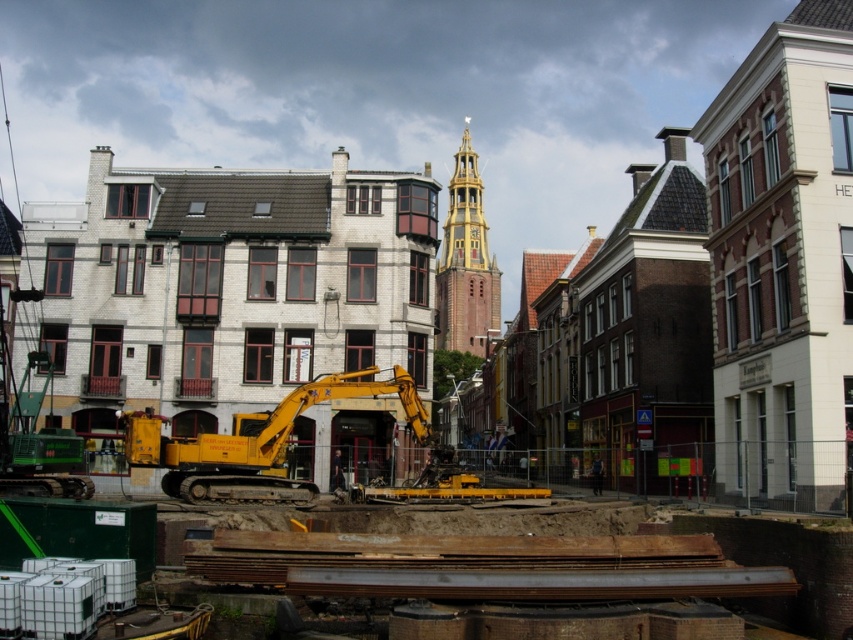
You are a construction worker standing at the yellow excavator in the foreground of the urban construction site. You need to place a safety barrier between the two points labeled point 1 at point (219, 499) and point 2 at point (469, 339). Which point should the barrier be closer to the excavator?

The barrier should be placed closer to point 1 at point (219, 499) because it is in front of point 2 at point (469, 339) from the excavator.

You are a city planner assessing the construction site. You need to determine if there is enough space to accommodate both the yellow metallic excavator at center and the gold textured clock tower at center without overlapping. Based on their sizes, can they coexist in the current layout?

The yellow metallic excavator at center occupies less space than the gold textured clock tower at center, so they can coexist in the current layout as long as there is sufficient total space allocated for both.